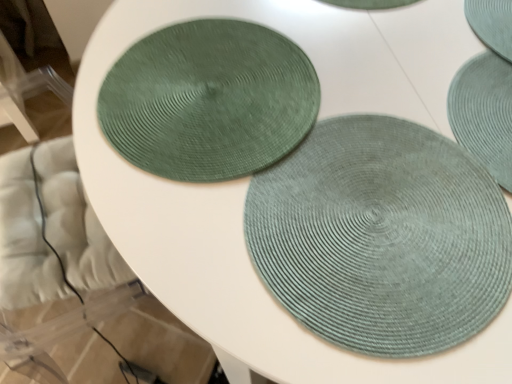
Question: From the image's perspective, is sage green woven mat at center, positioned as the 1th mat in back-to-front order, above teal woven coaster at upper right, positioned as the 2th coaster in left-to-right order?

Choices:
 (A) no
 (B) yes

Answer: (A)

Question: Is sage green woven mat at center, placed as the second mat when sorted from front to back, to the left of teal woven coaster at upper right, the first coaster when ordered from right to left, from the viewer's perspective?

Choices:
 (A) yes
 (B) no

Answer: (A)

Question: Does sage green woven mat at center, positioned as the 1th mat in back-to-front order, touch teal woven coaster at upper right, positioned as the 2th coaster in left-to-right order?

Choices:
 (A) no
 (B) yes

Answer: (A)

Question: Is sage green woven mat at center, placed as the second mat when sorted from front to back, wider than teal woven coaster at upper right, positioned as the 2th coaster in left-to-right order?

Choices:
 (A) no
 (B) yes

Answer: (B)

Question: Is teal woven coaster at upper right, the first coaster when ordered from right to left, inside sage green woven mat at center, positioned as the 1th mat in back-to-front order?

Choices:
 (A) no
 (B) yes

Answer: (A)

Question: Based on their positions, is sage green woven mat at center, placed as the second mat when sorted from back to front, located to the left or right of green woven coaster at upper left, the 1th coaster when ordered from left to right?

Choices:
 (A) right
 (B) left

Answer: (A)

Question: Is sage green woven mat at center, arranged as the 1th mat when viewed from the front, situated inside green woven coaster at upper left, arranged as the 2th coaster when viewed from the right, or outside?

Choices:
 (A) inside
 (B) outside

Answer: (B)

Question: Is point (399, 342) closer or farther from the camera than point (112, 79)?

Choices:
 (A) closer
 (B) farther

Answer: (A)

Question: From their relative heights in the image, would you say sage green woven mat at center, placed as the second mat when sorted from back to front, is taller or shorter than green woven coaster at upper left, the 1th coaster when ordered from left to right?

Choices:
 (A) short
 (B) tall

Answer: (B)

Question: Based on their positions, is green woven coaster at upper left, arranged as the 2th coaster when viewed from the right, located to the left or right of sage green woven mat at center, placed as the second mat when sorted from front to back?

Choices:
 (A) left
 (B) right

Answer: (A)

Question: Is green woven coaster at upper left, the 1th coaster when ordered from left to right, taller or shorter than sage green woven mat at center, placed as the second mat when sorted from front to back?

Choices:
 (A) short
 (B) tall

Answer: (A)

Question: Looking at the image, does green woven coaster at upper left, the 1th coaster when ordered from left to right, seem bigger or smaller compared to sage green woven mat at center, placed as the second mat when sorted from front to back?

Choices:
 (A) small
 (B) big

Answer: (A)

Question: From a real-world perspective, is green woven coaster at upper left, arranged as the 2th coaster when viewed from the right, physically located above or below sage green woven mat at center, placed as the second mat when sorted from front to back?

Choices:
 (A) below
 (B) above

Answer: (A)

Question: Is sage green woven mat at center, positioned as the 1th mat in back-to-front order, in front of or behind teal woven coaster at upper right, positioned as the 2th coaster in left-to-right order, in the image?

Choices:
 (A) front
 (B) behind

Answer: (A)

Question: Based on their positions, is sage green woven mat at center, positioned as the 1th mat in back-to-front order, located to the left or right of teal woven coaster at upper right, the first coaster when ordered from right to left?

Choices:
 (A) right
 (B) left

Answer: (B)